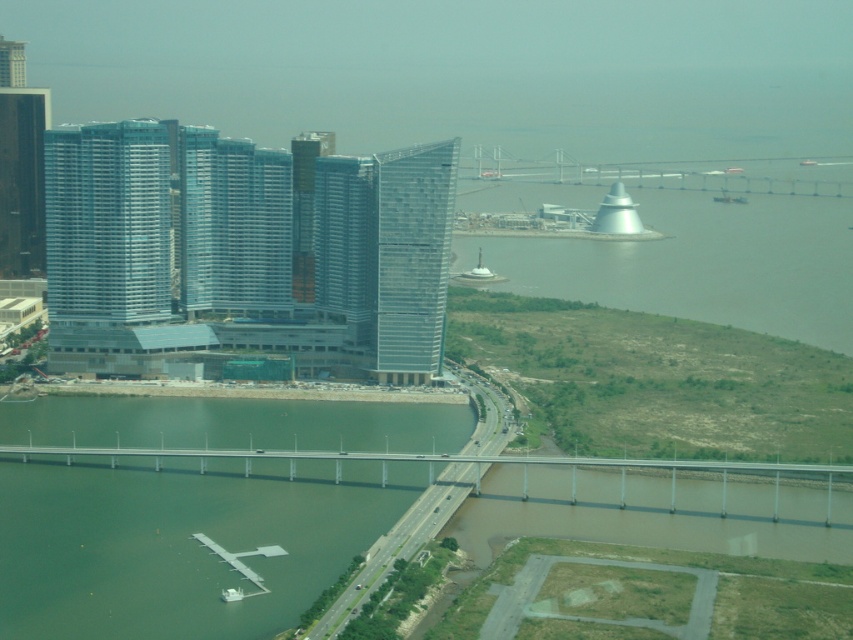
From the picture: Between glassy blue skyscraper at center-left and dark glass skyscraper at left, which one is positioned higher?

Positioned higher is dark glass skyscraper at left.

Between glassy blue skyscraper at center-left and dark glass skyscraper at left, which one has less height?

Standing shorter between the two is dark glass skyscraper at left.

Does point (125, 296) come in front of point (10, 168)?

Yes, point (125, 296) is in front of point (10, 168).

The width and height of the screenshot is (853, 640). I want to click on glassy blue skyscraper at center-left, so click(242, 253).

Looking at this image, who is positioned more to the right, glassy blue skyscraper at center-left or transparent glass skyscraper at center?

transparent glass skyscraper at center

Can you confirm if glassy blue skyscraper at center-left is positioned to the left of transparent glass skyscraper at center?

Yes, glassy blue skyscraper at center-left is to the left of transparent glass skyscraper at center.

Which is in front, point (77, 246) or point (396, 196)?

Positioned in front is point (396, 196).

The height and width of the screenshot is (640, 853). Identify the location of glassy blue skyscraper at center-left. (242, 253).

Can you confirm if transparent glass skyscraper at center is bigger than concrete bridge at center?

No.

Is transparent glass skyscraper at center thinner than concrete bridge at center?

Indeed, transparent glass skyscraper at center has a lesser width compared to concrete bridge at center.

Does point (424, 192) lie behind point (830, 480)?

No, it is not.

Where is `transparent glass skyscraper at center`? The height and width of the screenshot is (640, 853). transparent glass skyscraper at center is located at coordinates (387, 252).